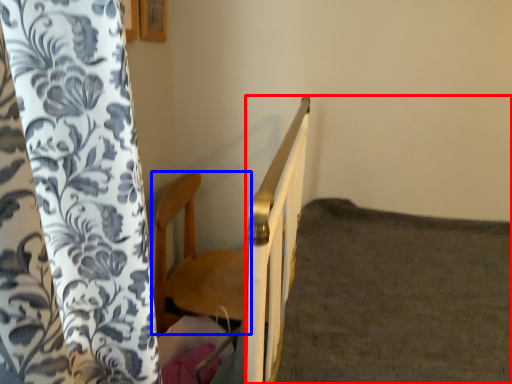
Question: Which point is closer to the camera, bed frame (highlighted by a red box) or furniture (highlighted by a blue box)?

Choices:
 (A) bed frame
 (B) furniture

Answer: (A)